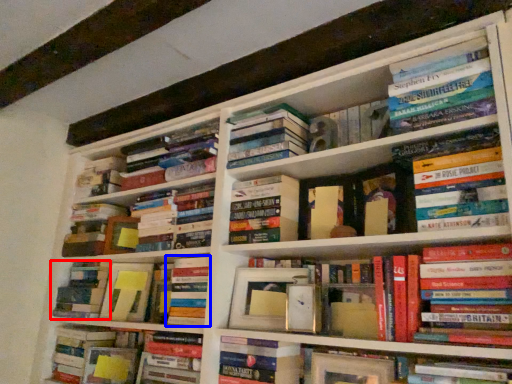
Question: Which of the following is the farthest to the observer, book (highlighted by a red box) or book (highlighted by a blue box)?

Choices:
 (A) book
 (B) book

Answer: (A)